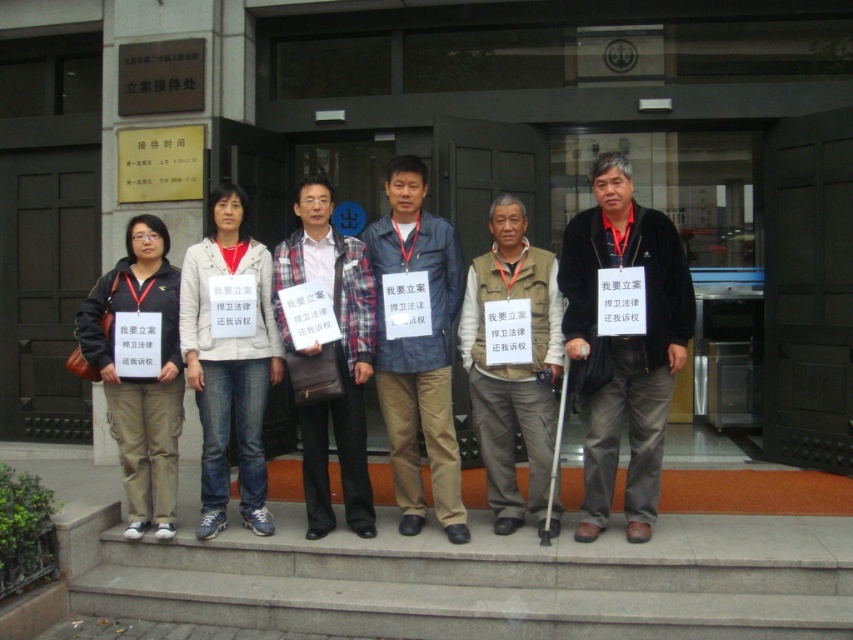
You are a photographer trying to capture a clear photo of the dark gray pants at center and the brown vest at center. Since you want to ensure both are visible, which object should you focus on first to account for their sizes?

The dark gray pants at center has a smaller size compared to brown vest at center. You should focus on the dark gray pants at center first because it is smaller and might require precise focus to capture details clearly before adjusting for the larger brown vest at center.

You are a photographer trying to capture a photo of the denim jeans at center and the matte black jacket at left. If you want to ensure both items are fully visible in the frame without cropping, which item requires more horizontal space in the camera frame?

The denim jeans at center requires more horizontal space in the camera frame because its width surpasses that of the matte black jacket at left.